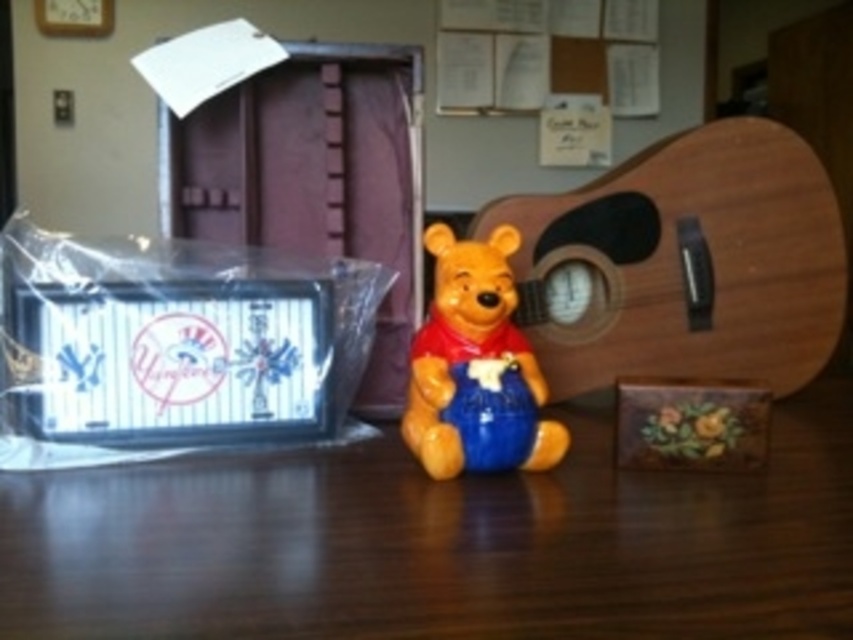
You are organizing items on a desk and need to ensure that the wooden at center doesn not block the view of the matte ceramic bear at center. Based on their heights, which object should be placed lower to achieve this?

The wooden at center has a lesser height compared to matte ceramic bear at center. To ensure the wooden at center doesn not block the view of the matte ceramic bear at center, place the wooden at center lower since it is shorter and will not obstruct the taller matte ceramic bear at center.

You are organizing a desk and see the wooden at center and the matte ceramic bear at center. Which object is positioned lower on the desk?

The wooden at center is located below the matte ceramic bear at center, so it is positioned lower on the desk.

You are organizing items on a desk and need to place a 4.5 inch wide book between the wooden at center and the matte ceramic bear at center. Can the book fit in the space between them?

The wooden at center is 5.08 inches away from the matte ceramic bear at center. Since the book is 4.5 inches wide, it can fit in the space between them as the distance is greater than the book width.